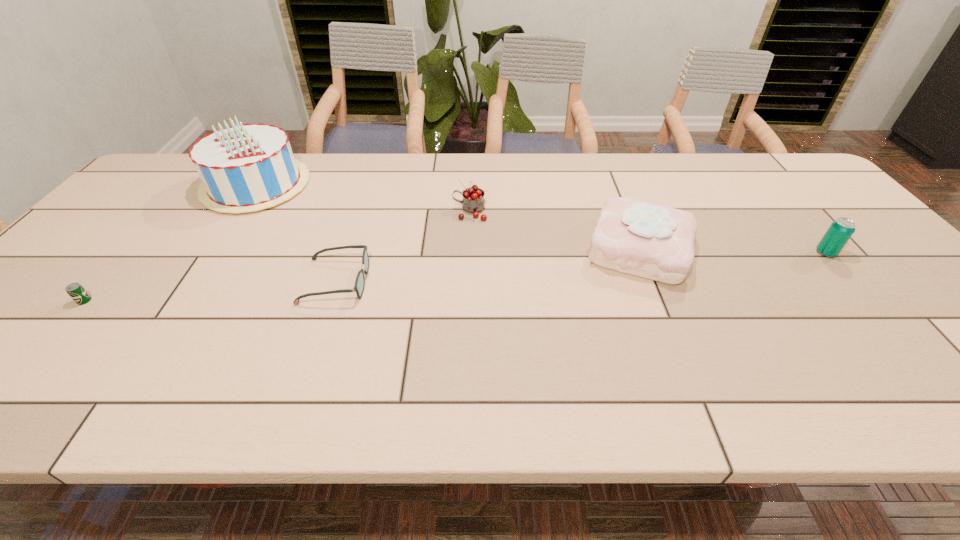
You are a GUI agent. You are given a task and a screenshot of the screen. Output one action in this format:
    pyautogui.click(x=<x>, y=<y>)
    Task: Click on the tallest object
    
    Given the screenshot: What is the action you would take?
    pos(244,168)

Locate an element on the screen. The width and height of the screenshot is (960, 540). the second object from right to left is located at coordinates (653, 241).

Identify the location of the third object from right to left. (473, 201).

At what (x,y) coordinates should I click in order to perform the action: click on the rightmost object. Please return your answer as a coordinate pair (x, y). The height and width of the screenshot is (540, 960). Looking at the image, I should click on (840, 231).

Find the location of a particular element. This screenshot has width=960, height=540. the taller beer can is located at coordinates (840, 231).

At what (x,y) coordinates should I click in order to perform the action: click on spectacles. Please return your answer as a coordinate pair (x, y). The height and width of the screenshot is (540, 960). Looking at the image, I should click on (359, 285).

You are a GUI agent. You are given a task and a screenshot of the screen. Output one action in this format:
    pyautogui.click(x=<x>, y=<y>)
    Task: Click on the nearer beer can
    The width and height of the screenshot is (960, 540).
    Given the screenshot: What is the action you would take?
    coord(76,291)

The image size is (960, 540). I want to click on the shortest object, so click(76, 291).

At what (x,y) coordinates should I click in order to perform the action: click on free space located 0.140m on the right of the birthday cake. Please return your answer as a coordinate pair (x, y). Looking at the image, I should click on (353, 185).

At what (x,y) coordinates should I click in order to perform the action: click on vacant space positioned 0.080m on the right of the cake. Please return your answer as a coordinate pair (x, y). The image size is (960, 540). Looking at the image, I should click on (727, 248).